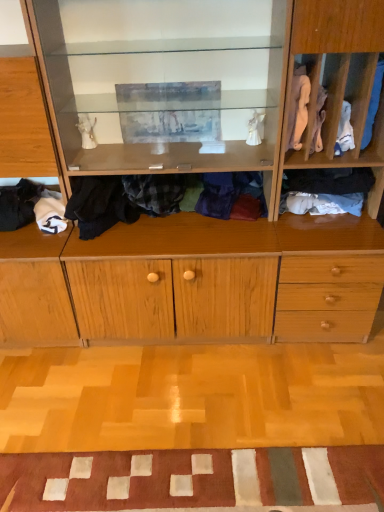
Question: Can we say white fabric at right, the third clothing in the left-to-right sequence, lies outside patchwork fabric doormat at lower center?

Choices:
 (A) yes
 (B) no

Answer: (A)

Question: From the image's perspective, is white fabric at right, the third clothing in the left-to-right sequence, beneath patchwork fabric doormat at lower center?

Choices:
 (A) no
 (B) yes

Answer: (A)

Question: From a real-world perspective, is white fabric at right, the third clothing in the left-to-right sequence, located higher than patchwork fabric doormat at lower center?

Choices:
 (A) no
 (B) yes

Answer: (B)

Question: Could you tell me if white fabric at right, the third clothing in the left-to-right sequence, is turned towards patchwork fabric doormat at lower center?

Choices:
 (A) yes
 (B) no

Answer: (B)

Question: Is white fabric at right, the fourth clothing when ordered from right to left, smaller than patchwork fabric doormat at lower center?

Choices:
 (A) yes
 (B) no

Answer: (A)

Question: Can you confirm if white fabric at right, the fourth clothing when ordered from right to left, is shorter than patchwork fabric doormat at lower center?

Choices:
 (A) no
 (B) yes

Answer: (A)

Question: From the image's perspective, is flannel shirt at center, the second clothing when ordered from left to right, below soft white fabric at lower left, the sixth clothing positioned from the right?

Choices:
 (A) no
 (B) yes

Answer: (A)

Question: Can you confirm if flannel shirt at center, which appears as the 5th clothing when viewed from the right, is smaller than soft white fabric at lower left, the sixth clothing positioned from the right?

Choices:
 (A) yes
 (B) no

Answer: (B)

Question: Is flannel shirt at center, which appears as the 5th clothing when viewed from the right, closer to camera compared to soft white fabric at lower left, which appears as the 1th clothing when viewed from the left?

Choices:
 (A) yes
 (B) no

Answer: (A)

Question: Is flannel shirt at center, the second clothing when ordered from left to right, at the left side of soft white fabric at lower left, the sixth clothing positioned from the right?

Choices:
 (A) no
 (B) yes

Answer: (A)

Question: Does flannel shirt at center, the second clothing when ordered from left to right, have a lesser width compared to soft white fabric at lower left, the sixth clothing positioned from the right?

Choices:
 (A) no
 (B) yes

Answer: (B)

Question: Is flannel shirt at center, which appears as the 5th clothing when viewed from the right, taller than soft white fabric at lower left, the sixth clothing positioned from the right?

Choices:
 (A) no
 (B) yes

Answer: (B)

Question: Is white cotton socks at right, which is the fifth clothing in left-to-right order, not close to wooden cabinet at center, which is the 1th cabinetry in right-to-left order?

Choices:
 (A) no
 (B) yes

Answer: (A)